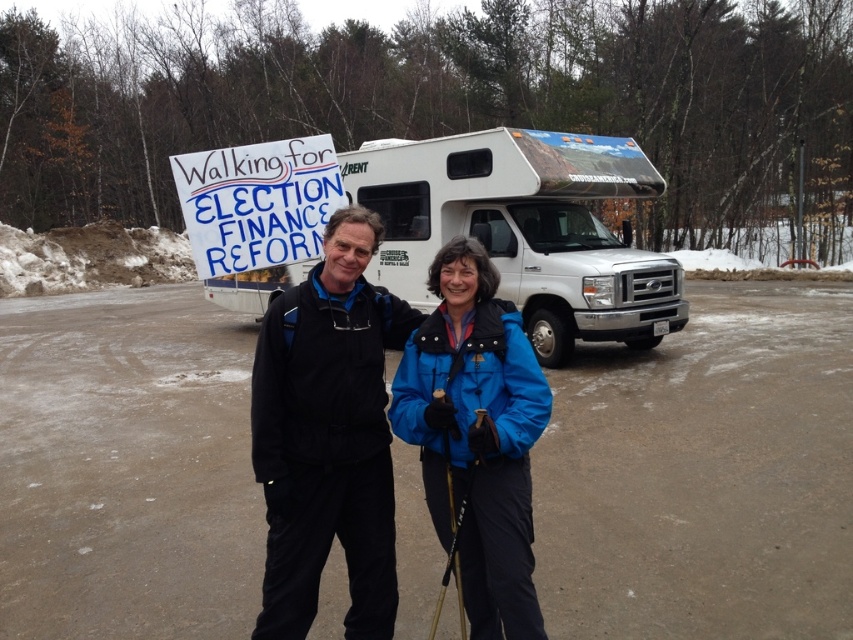
You are standing at the point marked as point (401, 275) in the image. The RV is parked behind you. If you turn around, will you be able to see the RV directly in front of you?

The distance of point (401, 275) from viewer is 33.11 feet. Since the RV is parked behind you, turning around would face you away from the RV, so you would not see it directly in front of you.

You are a photographer setting up a tripod in the parking lot. The matte black jacket at center and the black plastic ski pole at center are both in your frame. If you want to ensure both objects are fully visible in your photo, which object should you focus on to adjust the tripod height?

You should focus on adjusting the tripod height to accommodate the matte black jacket at center since it has a greater height compared to the black plastic ski pole at center, ensuring both are fully visible.